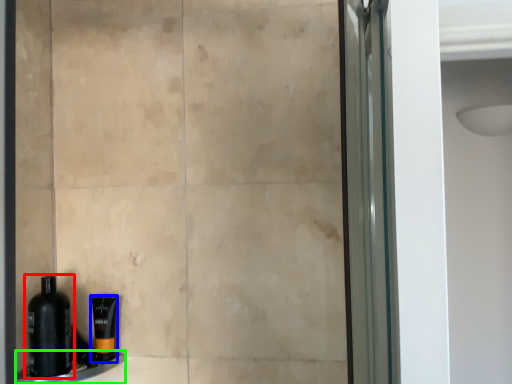
Question: Estimate the real-world distances between objects in this image. Which object is farther from bottle (highlighted by a red box), toiletry (highlighted by a blue box) or ledge (highlighted by a green box)?

Choices:
 (A) toiletry
 (B) ledge

Answer: (A)